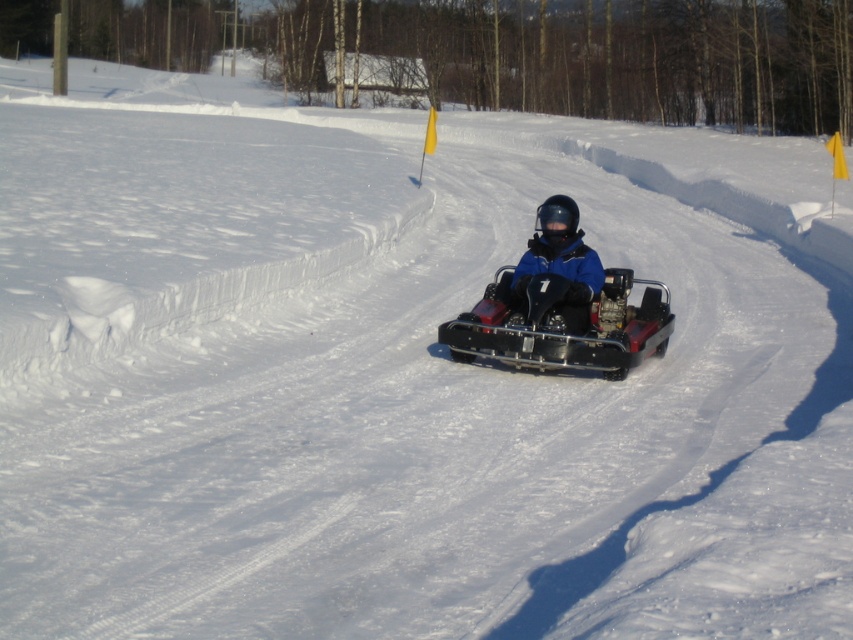
Question: Can you confirm if black plastic go-kart at center is smaller than blue matte jacket at center?

Choices:
 (A) no
 (B) yes

Answer: (A)

Question: Is black plastic go-kart at center behind blue matte jacket at center?

Choices:
 (A) yes
 (B) no

Answer: (B)

Question: Does black plastic go-kart at center have a lesser width compared to blue matte jacket at center?

Choices:
 (A) yes
 (B) no

Answer: (B)

Question: Which object appears closest to the camera in this image?

Choices:
 (A) black plastic go-kart at center
 (B) blue matte jacket at center

Answer: (A)

Question: Among these points, which one is farthest from the camera?

Choices:
 (A) (552, 353)
 (B) (576, 305)

Answer: (B)

Question: Which point is closer to the camera?

Choices:
 (A) black plastic go-kart at center
 (B) blue matte jacket at center

Answer: (A)